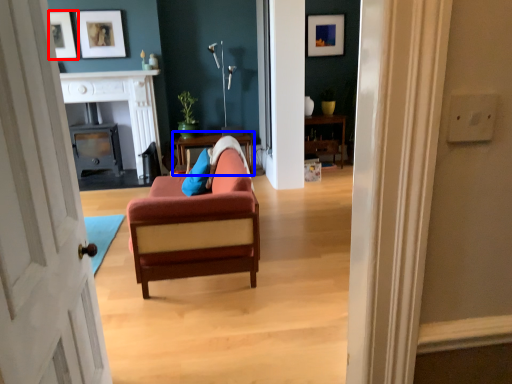
Question: Which object appears closest to the camera in this image, picture frame (highlighted by a red box) or table (highlighted by a blue box)?

Choices:
 (A) picture frame
 (B) table

Answer: (A)